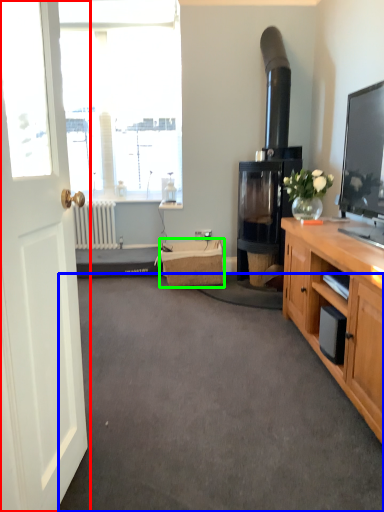
Question: Which is nearer to the door (highlighted by a red box)? plain (highlighted by a blue box) or picnic basket (highlighted by a green box).

Choices:
 (A) plain
 (B) picnic basket

Answer: (A)